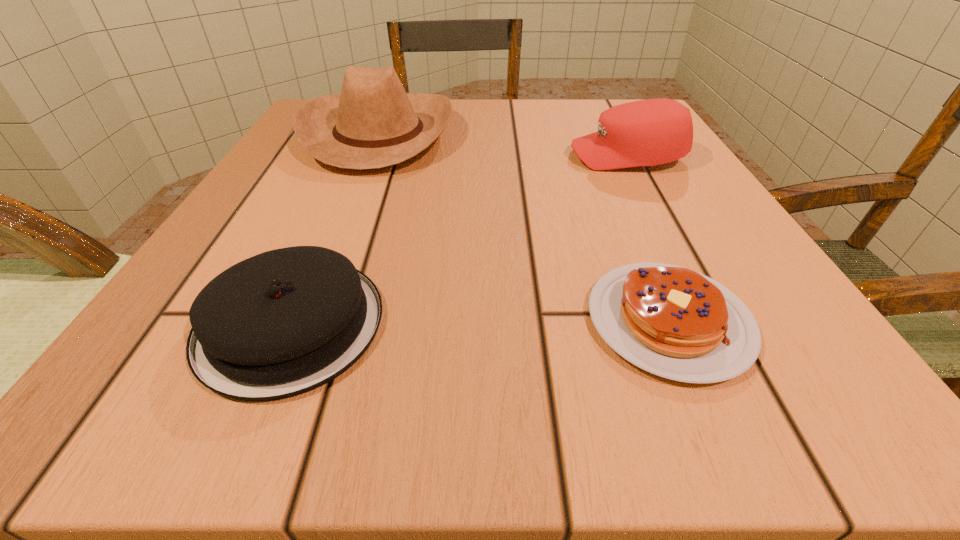
The height and width of the screenshot is (540, 960). I want to click on cowboy hat, so click(x=373, y=123).

The image size is (960, 540). What are the coordinates of `the third shortest object` in the screenshot? It's located at (650, 132).

I want to click on the taller pancake, so click(x=284, y=322).

This screenshot has width=960, height=540. I want to click on the second shortest object, so click(x=284, y=322).

At what (x,y) coordinates should I click in order to perform the action: click on the shortest object. Please return your answer as a coordinate pair (x, y). This screenshot has width=960, height=540. Looking at the image, I should click on (671, 321).

Image resolution: width=960 pixels, height=540 pixels. I want to click on the shorter pancake, so click(671, 321).

Find the location of a particular element. The height and width of the screenshot is (540, 960). vacant area situated on the front-facing side of the cowboy hat is located at coordinates (543, 133).

At what (x,y) coordinates should I click in order to perform the action: click on vacant region located on the front-facing side of the cap. Please return your answer as a coordinate pair (x, y). Image resolution: width=960 pixels, height=540 pixels. Looking at the image, I should click on (498, 156).

Find the location of a particular element. The image size is (960, 540). vacant position located on the front-facing side of the cap is located at coordinates click(405, 156).

The height and width of the screenshot is (540, 960). I want to click on blank area located 0.230m on the front-facing side of the cap, so click(x=444, y=156).